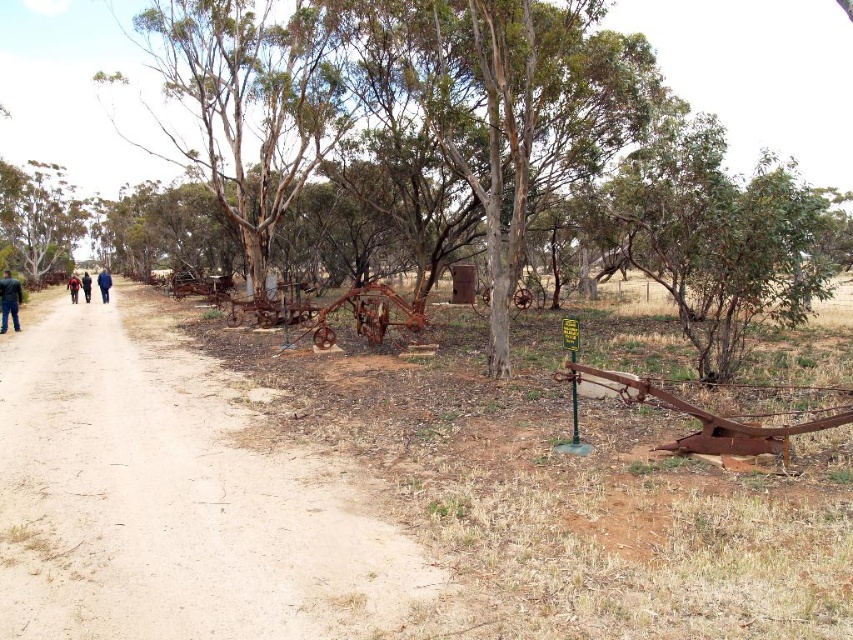
Question: Which point appears farthest from the camera in this image?

Choices:
 (A) (15, 234)
 (B) (798, 465)
 (C) (51, 582)

Answer: (A)

Question: Where is rusty metal plow at center-right located in relation to green rough bark tree at upper left in the image?

Choices:
 (A) above
 (B) below

Answer: (B)

Question: Is the position of green rough bark tree at upper left less distant than that of dark blue jeans at center?

Choices:
 (A) no
 (B) yes

Answer: (A)

Question: Among these objects, which one is nearest to the camera?

Choices:
 (A) green rough bark tree at upper left
 (B) dark blue jeans at center

Answer: (B)

Question: Among these objects, which one is nearest to the camera?

Choices:
 (A) brown dirt path at center
 (B) rusty metal plow at center-right
 (C) dark blue jeans at left

Answer: (B)

Question: Is brown dirt path at center to the right of dark blue jeans at center from the viewer's perspective?

Choices:
 (A) yes
 (B) no

Answer: (A)